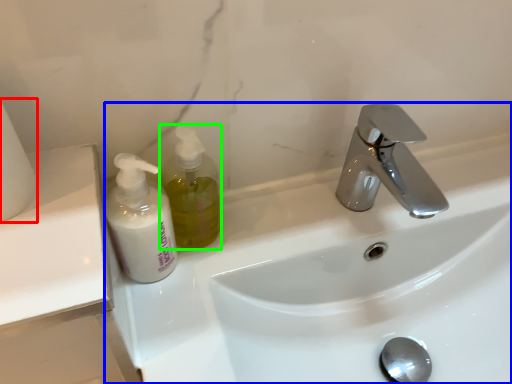
Question: Which object is positioned closest to toilet paper (highlighted by a red box)? Select from sink (highlighted by a blue box) and soap dispenser (highlighted by a green box).

Choices:
 (A) sink
 (B) soap dispenser

Answer: (B)